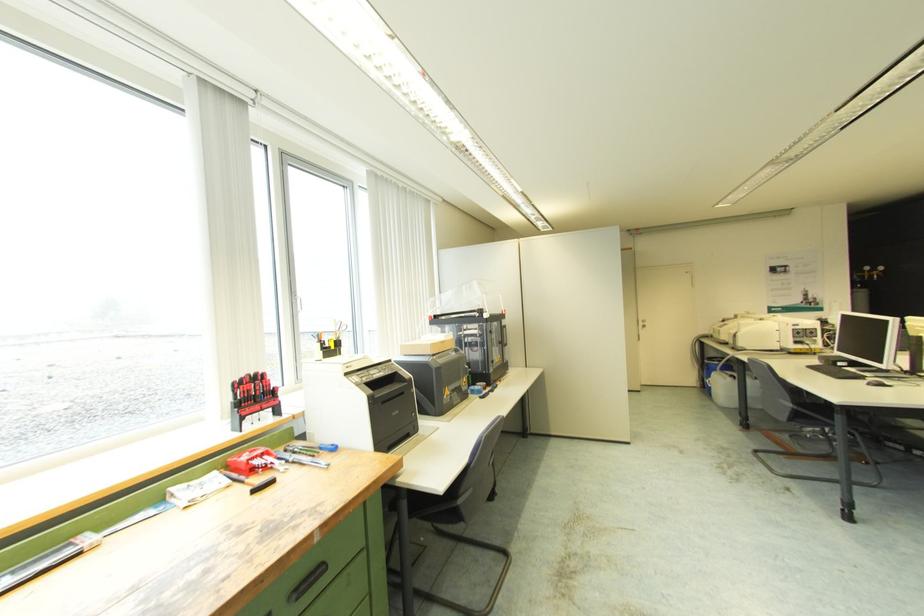
Where would you pull the silver door handle? Please return your answer as a coordinate pair (x, y).

(307, 582)